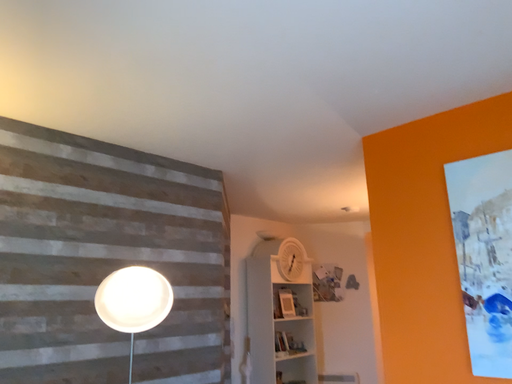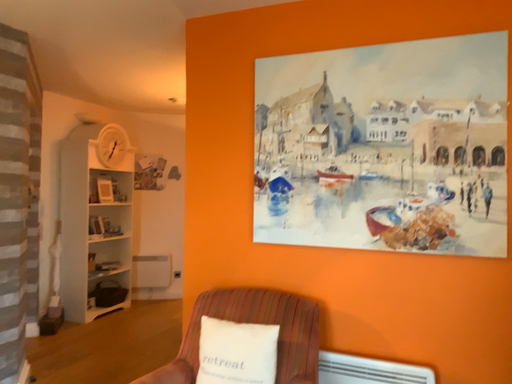
Question: How did the camera likely rotate when shooting the video?

Choices:
 (A) rotated upward
 (B) rotated downward

Answer: (B)